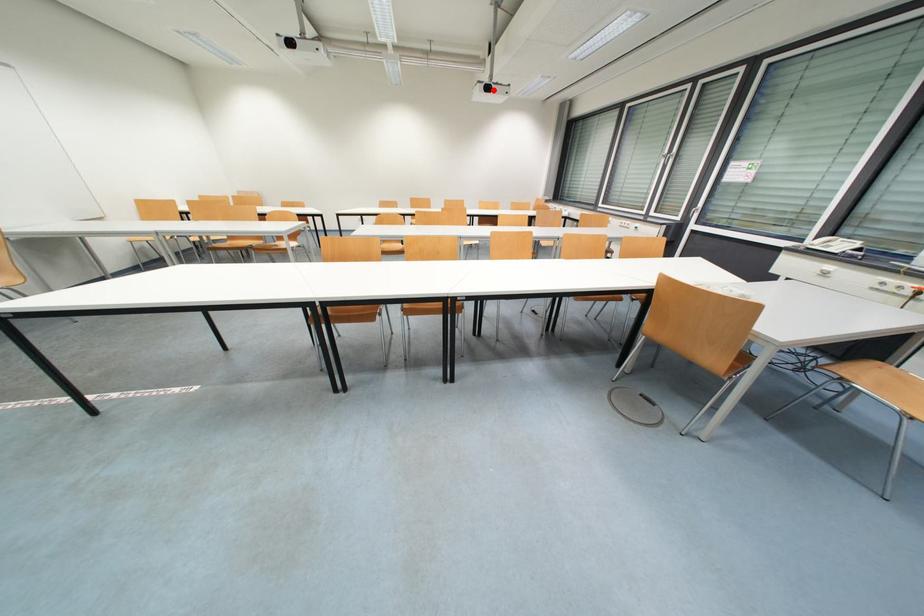
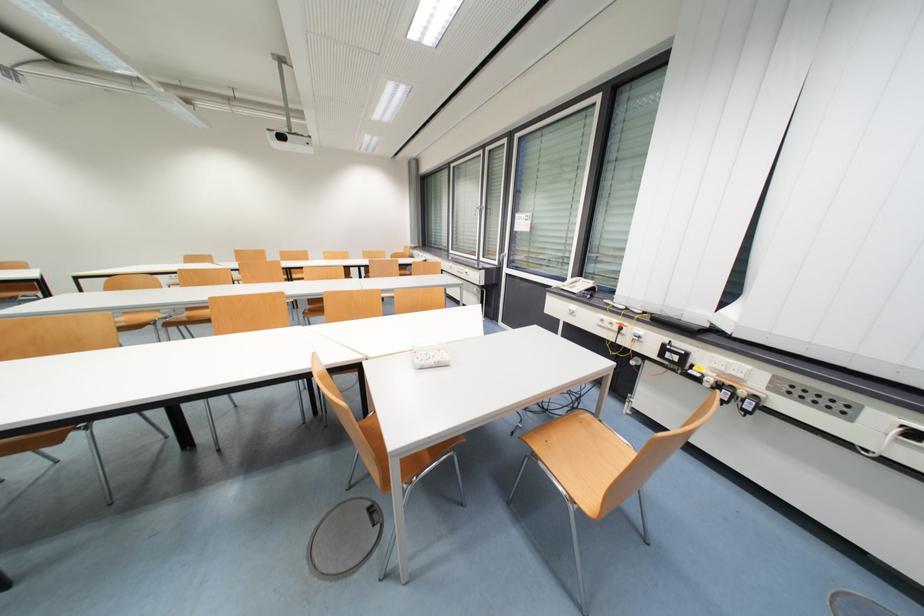
In the second image, find the point that corresponds to the highlighted location in the first image.

(286, 139)